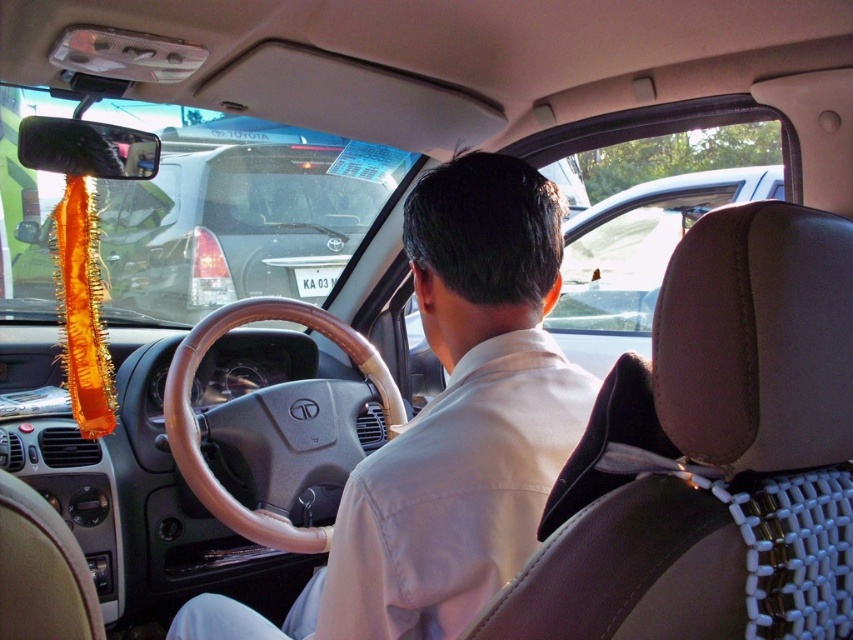
You are sitting in the passenger seat of the car and want to reach for the light beige leather shirt at center and the brown leather steering wheel at center. Which object is closer to you?

The light beige leather shirt at center is closer to the viewer than the brown leather steering wheel at center, so the light beige leather shirt at center is closer to you.

You are sitting in the passenger seat of the car. You notice two points marked in the image. Which point, point (445, 502) or point (283, 518), is closer to you?

Point (445, 502) is closer to the camera than point (283, 518), so the point closer to you is point (445, 502).